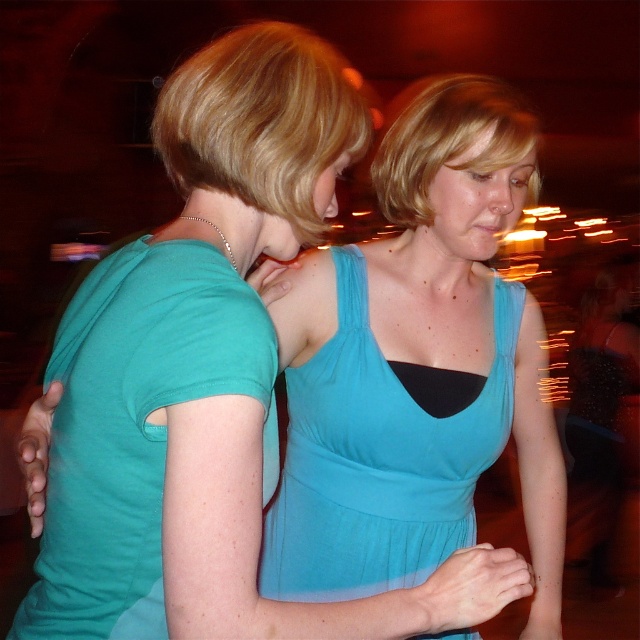
Is teal jersey dress at center positioned at the back of blonde hair at upper center?

That is True.

Who is more distant from viewer, (352, 369) or (305, 131)?

The point (352, 369) is more distant.

You are a GUI agent. You are given a task and a screenshot of the screen. Output one action in this format:
    pyautogui.click(x=<x>, y=<y>)
    Task: Click on the teal jersey dress at center
    
    Given the screenshot: What is the action you would take?
    pyautogui.click(x=380, y=456)

Identify the location of teal jersey dress at center. The image size is (640, 640). (380, 456).

Does matte teal shirt at left appear on the left side of blonde hair at upper center?

Correct, you'll find matte teal shirt at left to the left of blonde hair at upper center.

Is point (147, 636) positioned in front of point (221, 161)?

Yes, it is.

Between point (172, 289) and point (170, 100), which one is positioned in front?

Positioned in front is point (172, 289).

Identify the location of matte teal shirt at left. (134, 428).

Describe the element at coordinates (134, 428) in the screenshot. I see `matte teal shirt at left` at that location.

Between matte teal shirt at left and teal jersey dress at center, which one is positioned higher?

matte teal shirt at left

What are the coordinates of `matte teal shirt at left` in the screenshot? It's located at (134, 428).

Identify the location of matte teal shirt at left. (134, 428).